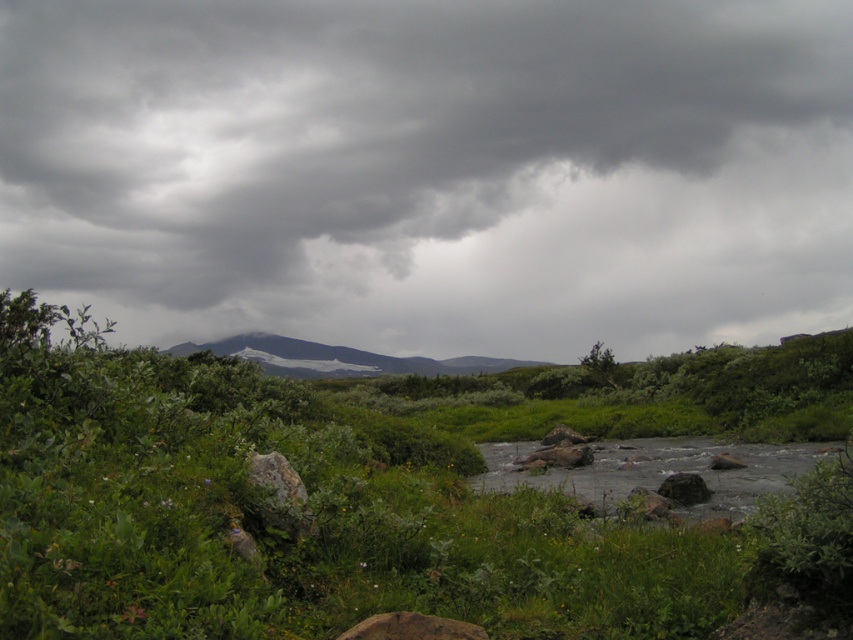
Question: Which object is positioned closest to the rusty rock at center?

Choices:
 (A) snowy rock mountain at center
 (B) green leafy shrubs at center
 (C) smooth gray rock at center

Answer: (B)

Question: Which point is closer to the camera taking this photo?

Choices:
 (A) (363, 628)
 (B) (300, 492)

Answer: (A)

Question: Which is farther from the green leafy shrubs at center?

Choices:
 (A) snowy rock mountain at center
 (B) gray rock at lower right

Answer: (A)

Question: Is the position of dark gray cloud at upper center less distant than that of snowy rock mountain at center?

Choices:
 (A) yes
 (B) no

Answer: (B)

Question: Can you confirm if dark gray cloud at upper center is positioned to the left of gray rock at lower right?

Choices:
 (A) no
 (B) yes

Answer: (B)

Question: Observing the image, what is the correct spatial positioning of dark gray cloud at upper center in reference to snowy rock mountain at center?

Choices:
 (A) right
 (B) left

Answer: (A)